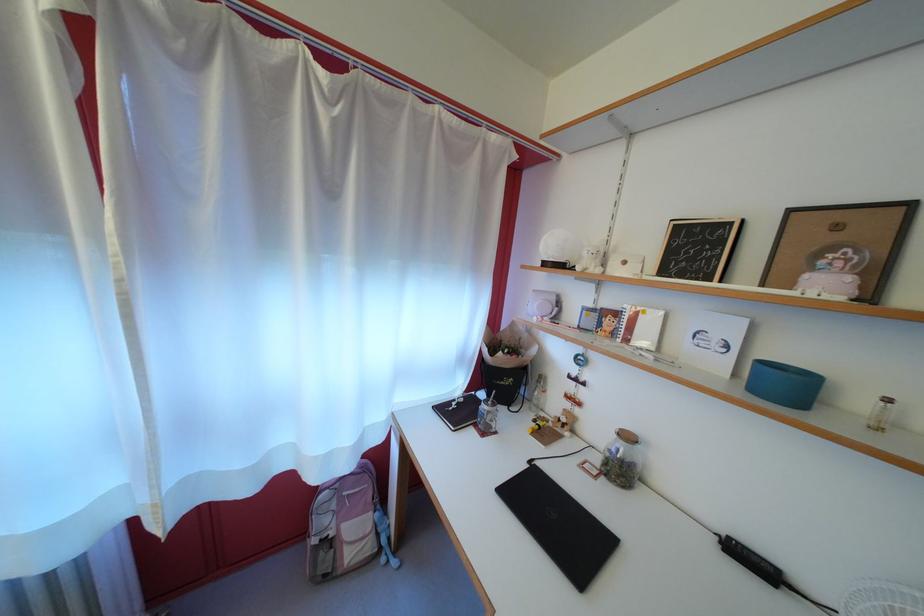
Find where to lift the blue cylindrical box. Please return your answer as a coordinate pair (x, y).

(784, 384)